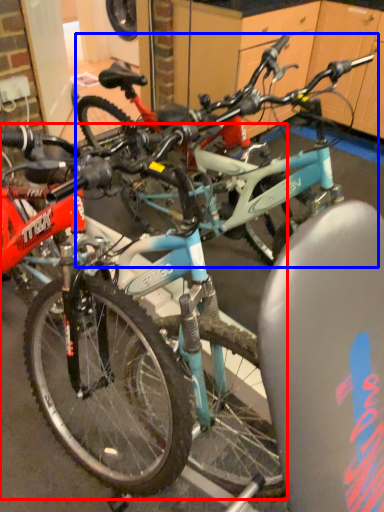
Question: Which of the following is the farthest to the observer, bicycle (highlighted by a red box) or bicycle (highlighted by a blue box)?

Choices:
 (A) bicycle
 (B) bicycle

Answer: (B)